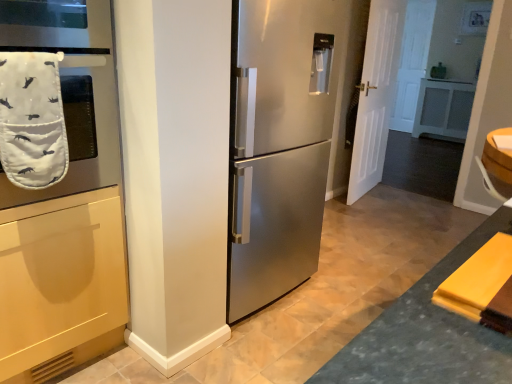
Question: Can you confirm if white quilted oven mitt at left is wider than stainless steel refrigerator at center?

Choices:
 (A) yes
 (B) no

Answer: (B)

Question: Would you say white quilted oven mitt at left is a long distance from stainless steel refrigerator at center?

Choices:
 (A) yes
 (B) no

Answer: (B)

Question: Is white quilted oven mitt at left completely or partially outside of stainless steel refrigerator at center?

Choices:
 (A) no
 (B) yes

Answer: (B)

Question: Does white quilted oven mitt at left have a greater height compared to stainless steel refrigerator at center?

Choices:
 (A) no
 (B) yes

Answer: (A)

Question: Considering the relative positions of white quilted oven mitt at left and stainless steel refrigerator at center in the image provided, is white quilted oven mitt at left behind stainless steel refrigerator at center?

Choices:
 (A) no
 (B) yes

Answer: (A)

Question: From the image's perspective, is white fabric oven mitt at left located above or below stainless steel refrigerator at center?

Choices:
 (A) above
 (B) below

Answer: (A)

Question: Is white fabric oven mitt at left wider or thinner than stainless steel refrigerator at center?

Choices:
 (A) thin
 (B) wide

Answer: (A)

Question: Is point (81, 129) positioned closer to the camera than point (321, 99)?

Choices:
 (A) closer
 (B) farther

Answer: (A)

Question: Considering the relative positions of white fabric oven mitt at left and stainless steel refrigerator at center in the image provided, is white fabric oven mitt at left to the left or to the right of stainless steel refrigerator at center?

Choices:
 (A) left
 (B) right

Answer: (A)

Question: Relative to white matte door at right, is white quilted oven mitt at left in front or behind?

Choices:
 (A) front
 (B) behind

Answer: (A)

Question: Is white quilted oven mitt at left taller or shorter than white matte door at right?

Choices:
 (A) short
 (B) tall

Answer: (A)

Question: Is point (31, 109) closer or farther from the camera than point (365, 134)?

Choices:
 (A) closer
 (B) farther

Answer: (A)

Question: Considering the relative positions of white quilted oven mitt at left and white matte door at right in the image provided, is white quilted oven mitt at left to the left or to the right of white matte door at right?

Choices:
 (A) right
 (B) left

Answer: (B)

Question: Is stainless steel refrigerator at center in front of or behind white matte door at right in the image?

Choices:
 (A) behind
 (B) front

Answer: (B)

Question: Is stainless steel refrigerator at center situated inside white matte door at right or outside?

Choices:
 (A) inside
 (B) outside

Answer: (B)